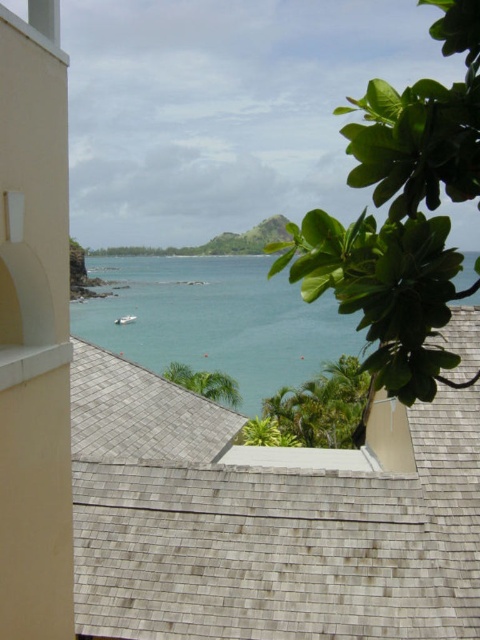
Does point (326, 520) lie behind point (239, 264)?

No, (326, 520) is in front of (239, 264).

Which is in front, point (257, 508) or point (354, 328)?

Point (257, 508)

Is point (238, 528) positioned behind point (151, 266)?

No, (238, 528) is closer to viewer.

The height and width of the screenshot is (640, 480). In order to click on gray shingles at center in this screenshot , I will do `click(266, 522)`.

At what (x,y) coordinates should I click in order to perform the action: click on clear blue water at center. Please return your answer as a coordinate pair (x, y). The width and height of the screenshot is (480, 640). Looking at the image, I should click on (216, 321).

Does clear blue water at center have a lesser width compared to white matte boat at center?

No.

Where is `clear blue water at center`? clear blue water at center is located at coordinates (216, 321).

Describe the element at coordinates (266, 522) in the screenshot. I see `gray shingles at center` at that location.

Does gray shingles at center have a greater width compared to white matte boat at center?

Yes.

Between point (320, 608) and point (132, 321), which one is positioned in front?

Point (320, 608) is more forward.

At what (x,y) coordinates should I click in order to perform the action: click on gray shingles at center. Please return your answer as a coordinate pair (x, y). The image size is (480, 640). Looking at the image, I should click on (266, 522).